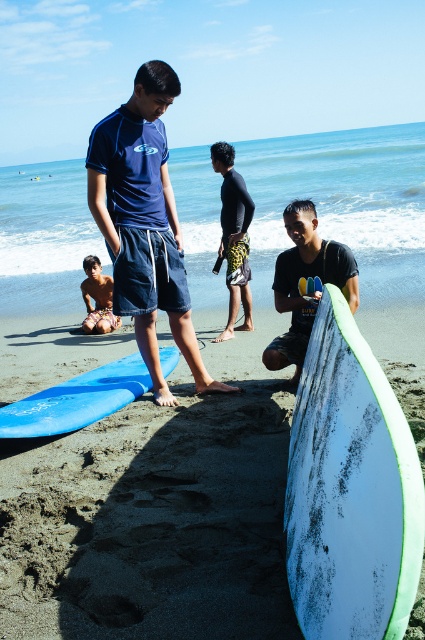
You are a beachgoer who wants to place your beach bag between the white matte surfboard at lower right and the matte blue shorts at center. Can you fit the bag there if the bag requires 5 feet of space?

The distance between the white matte surfboard at lower right and the matte blue shorts at center is 6.17 feet. Since the required space is 5 feet, the bag can fit comfortably between them.

You are a photographer at the beach and want to place a tripod exactly at the center of the frame. However, there is a matte blue shorts at center in the way. Where should you move the tripod to avoid it? Please provide coordinates relative to the frame, where the bottom left corner is the origin point.

The matte blue shorts at center is located at coordinates point (144, 224). To avoid it, move the tripod to the center point of the frame, which is at coordinates point (212, 320).